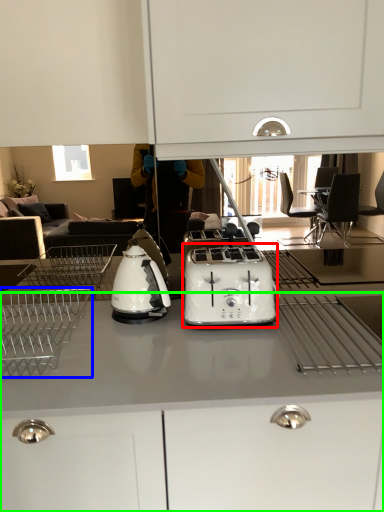
Question: Estimate the real-world distances between objects in this image. Which object is closer to toaster (highlighted by a red box), home appliance (highlighted by a blue box) or cabinetry (highlighted by a green box)?

Choices:
 (A) home appliance
 (B) cabinetry

Answer: (B)